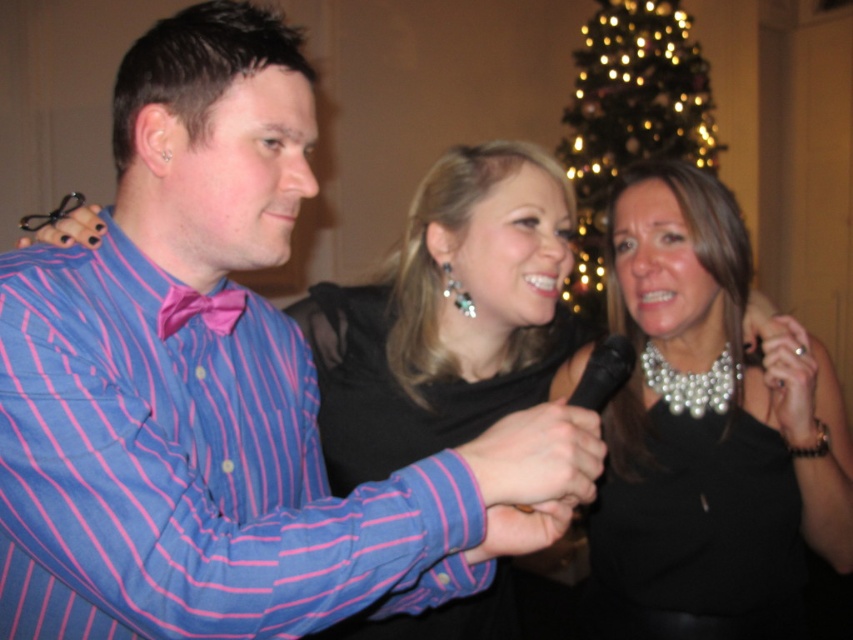
You are a photographer standing in front of the scene. You want to take a closeup photo of the pearl necklace at center. The camera you are using has a minimum focusing distance of 35 inches. Can you take the photo without moving closer?

The pearl necklace at center is 38.99 inches away from the viewer. Since the camera requires a minimum focusing distance of 35 inches, you need to move 4 inches closer to capture the closeup.

You are a photographer at the event and want to capture a clear photo of the pearl necklace at center. However, the black satin dress at center is blocking part of the necklace. Can you adjust your position to avoid the dress blocking the necklace?

The black satin dress at center is behind the pearl necklace at center, so moving your camera angle slightly forward or adjusting your position to focus directly on the pearl necklace at center should allow you to capture it without obstruction from the dress.